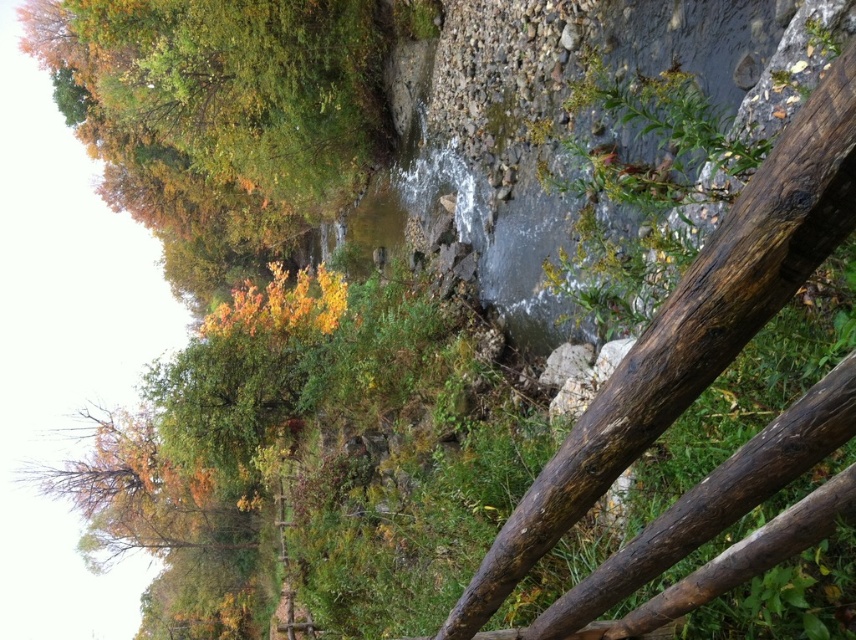
Looking at this image, you are a hiker trying to cross the stream in the image. You see autumn leaves at upper left and brown rough wood at center right. Which object would provide a wider surface to step on?

The autumn leaves at upper left provide a wider surface to step on since their width surpasses that of the brown rough wood at center right.